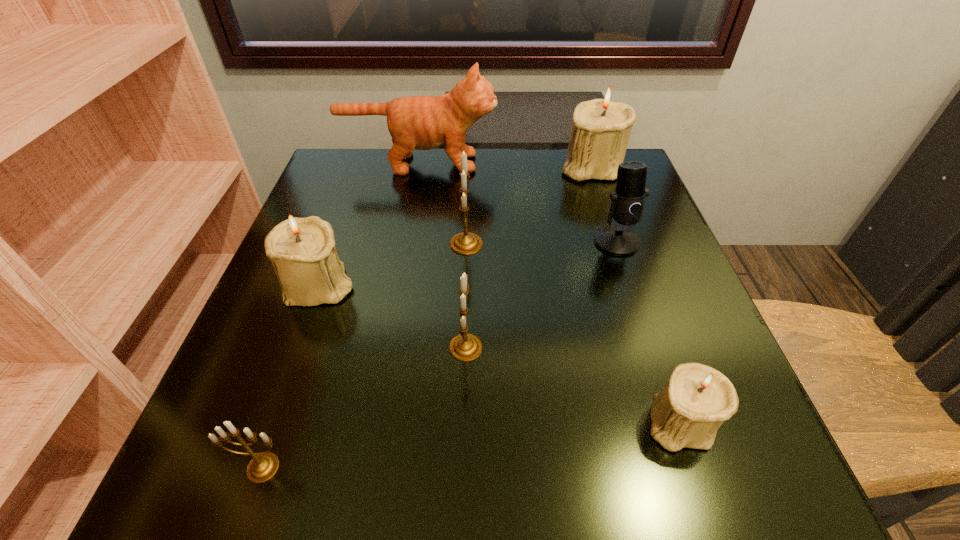
Locate an element on the screen. ginger cat is located at coordinates coord(418,122).

Locate an element on the screen. This screenshot has width=960, height=540. the biggest beige candle_holder is located at coordinates (601, 129).

Locate an element on the screen. The height and width of the screenshot is (540, 960). the farthest candelabrum is located at coordinates (601, 129).

You are a GUI agent. You are given a task and a screenshot of the screen. Output one action in this format:
    pyautogui.click(x=<x>, y=<y>)
    Task: Click on the biggest gold candelabrum
    The width and height of the screenshot is (960, 540).
    Given the screenshot: What is the action you would take?
    pyautogui.click(x=466, y=243)

At what (x,y) coordinates should I click in order to perform the action: click on microphone. Please return your answer as a coordinate pair (x, y). This screenshot has width=960, height=540. Looking at the image, I should click on (627, 204).

You are a GUI agent. You are given a task and a screenshot of the screen. Output one action in this format:
    pyautogui.click(x=<x>, y=<y>)
    Task: Click on the second farthest beige candle_holder
    The width and height of the screenshot is (960, 540).
    Given the screenshot: What is the action you would take?
    302,251

This screenshot has width=960, height=540. I want to click on the leftmost beige candle_holder, so click(302, 251).

Locate an element on the screen. the fourth farthest candelabrum is located at coordinates (465, 347).

At what (x,y) coordinates should I click in order to perform the action: click on the sixth farthest object. Please return your answer as a coordinate pair (x, y). The width and height of the screenshot is (960, 540). Looking at the image, I should click on (465, 347).

Find the location of a particular element. The width and height of the screenshot is (960, 540). the nearest beige candle_holder is located at coordinates (695, 401).